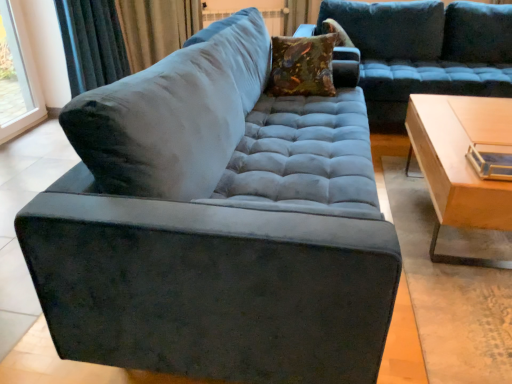
Image resolution: width=512 pixels, height=384 pixels. I want to click on velvet floral pillow at center, positioned as the second pillow in back-to-front order, so click(302, 66).

Find the location of `light wood/wooden table at right`. light wood/wooden table at right is located at coordinates (462, 163).

Find the location of a particular element. The width and height of the screenshot is (512, 384). transparent glass window at upper left is located at coordinates (17, 77).

Where is `velvet floral pillow at center, positioned as the second pillow in back-to-front order`? velvet floral pillow at center, positioned as the second pillow in back-to-front order is located at coordinates (302, 66).

Considering the sizes of light wood/wooden table at right and velvet floral pillow at center, which is counted as the first pillow, starting from the bottom, in the image, is light wood/wooden table at right bigger or smaller than velvet floral pillow at center, which is counted as the first pillow, starting from the bottom,?

In the image, light wood/wooden table at right appears to be larger than velvet floral pillow at center, which is counted as the first pillow, starting from the bottom.

From a real-world perspective, is light wood/wooden table at right on top of velvet floral pillow at center, which is counted as the 1th pillow, starting from the left?

Incorrect, from a real-world perspective, light wood/wooden table at right is lower than velvet floral pillow at center, which is counted as the 1th pillow, starting from the left.

Does light wood/wooden table at right turn towards velvet floral pillow at center, which is counted as the first pillow, starting from the bottom?

No, light wood/wooden table at right is not turned towards velvet floral pillow at center, which is counted as the first pillow, starting from the bottom.

Is the position of light wood/wooden table at right more distant than that of velvet floral pillow at center, placed as the 2th pillow when sorted from top to bottom?

No, the depth of light wood/wooden table at right is less than that of velvet floral pillow at center, placed as the 2th pillow when sorted from top to bottom.

Is transparent glass window at upper left oriented away from velvet-like brown pillow at upper center, which appears as the second pillow when viewed from the front?

transparent glass window at upper left does not have its back to velvet-like brown pillow at upper center, which appears as the second pillow when viewed from the front.

Can you confirm if transparent glass window at upper left is shorter than velvet-like brown pillow at upper center, the first pillow in the back-to-front sequence?

In fact, transparent glass window at upper left may be taller than velvet-like brown pillow at upper center, the first pillow in the back-to-front sequence.

Which of these two, transparent glass window at upper left or velvet-like brown pillow at upper center, marked as the second pillow in a bottom-to-top arrangement, is smaller?

transparent glass window at upper left.

Does point (15, 42) appear closer or farther from the camera than point (345, 32)?

Point (15, 42) is farther from the camera than point (345, 32).

Can you confirm if velvet curtain at upper left is shorter than velvet floral pillow at center, which is the first pillow in front-to-back order?

Incorrect, the height of velvet curtain at upper left does not fall short of that of velvet floral pillow at center, which is the first pillow in front-to-back order.

The image size is (512, 384). What are the coordinates of `curtain beneath the velvet floral pillow at center, positioned as the second pillow in back-to-front order (from a real-world perspective)` in the screenshot? It's located at (121, 36).

Considering their positions, is velvet curtain at upper left located in front of or behind velvet floral pillow at center, the second pillow viewed from the right?

In the image, velvet curtain at upper left appears behind velvet floral pillow at center, the second pillow viewed from the right.

Is velvet curtain at upper left turned away from velvet floral pillow at center, which is counted as the first pillow, starting from the bottom?

velvet curtain at upper left is not turned away from velvet floral pillow at center, which is counted as the first pillow, starting from the bottom.

Does velvet floral pillow at center, which is counted as the 1th pillow, starting from the left, have a smaller size compared to velvet blue couch at upper center?

Yes, velvet floral pillow at center, which is counted as the 1th pillow, starting from the left, is smaller than velvet blue couch at upper center.

Is velvet floral pillow at center, the second pillow viewed from the right, not near velvet blue couch at upper center?

Yes, velvet floral pillow at center, the second pillow viewed from the right, and velvet blue couch at upper center are quite far apart.

Choose the correct answer: Is velvet floral pillow at center, which is counted as the first pillow, starting from the bottom, inside velvet blue couch at upper center or outside it?

velvet floral pillow at center, which is counted as the first pillow, starting from the bottom, is not enclosed by velvet blue couch at upper center.

Does velvet curtain at upper left have a lesser width compared to velvet blue couch at upper center?

Yes, velvet curtain at upper left is thinner than velvet blue couch at upper center.

Considering the sizes of objects velvet curtain at upper left and velvet blue couch at upper center in the image provided, who is bigger, velvet curtain at upper left or velvet blue couch at upper center?

With larger size is velvet blue couch at upper center.

Between point (121, 75) and point (372, 101), which one is positioned behind?

The point (121, 75) is farther.

The image size is (512, 384). Find the location of `table located in front of the velvet-like brown pillow at upper center, marked as the second pillow in a bottom-to-top arrangement`. table located in front of the velvet-like brown pillow at upper center, marked as the second pillow in a bottom-to-top arrangement is located at coordinates (462, 163).

Considering the relative positions of light wood/wooden table at right and velvet-like brown pillow at upper center, placed as the 1th pillow when sorted from top to bottom, in the image provided, is light wood/wooden table at right to the left or to the right of velvet-like brown pillow at upper center, placed as the 1th pillow when sorted from top to bottom,?

Clearly, light wood/wooden table at right is on the right of velvet-like brown pillow at upper center, placed as the 1th pillow when sorted from top to bottom, in the image.

Which is behind, point (420, 139) or point (329, 20)?

The point (329, 20) is farther from the camera.

From a real-world perspective, is velvet-like brown pillow at upper center, the first pillow in the back-to-front sequence, above or below velvet blue couch at upper center?

velvet-like brown pillow at upper center, the first pillow in the back-to-front sequence, is above velvet blue couch at upper center.

Would you consider velvet-like brown pillow at upper center, placed as the 1th pillow when sorted from top to bottom, to be distant from velvet blue couch at upper center?

No.

From the image's perspective, between velvet-like brown pillow at upper center, marked as the second pillow in a bottom-to-top arrangement, and velvet blue couch at upper center, which one is located above?

velvet-like brown pillow at upper center, marked as the second pillow in a bottom-to-top arrangement, appears higher in the image.

This screenshot has height=384, width=512. What are the coordinates of `the 1st pillow positioned above the light wood/wooden table at right (from the image's perspective)` in the screenshot? It's located at (302, 66).

Locate an element on the screen. This screenshot has height=384, width=512. pillow behind the transparent glass window at upper left is located at coordinates point(337,32).

Which object lies further to the anchor point transparent glass window at upper left, velvet blue couch at upper center or light wood/wooden table at right?

light wood/wooden table at right is further to transparent glass window at upper left.

Based on their spatial positions, is velvet curtain at upper left or velvet blue couch at upper center closer to light wood/wooden table at right?

Based on the image, velvet blue couch at upper center appears to be nearer to light wood/wooden table at right.

Considering their positions, is velvet blue couch at upper center positioned closer to light wood/wooden table at right than velvet floral pillow at center, which is the first pillow in front-to-back order?

Among the two, velvet floral pillow at center, which is the first pillow in front-to-back order, is located nearer to light wood/wooden table at right.

Based on their spatial positions, is velvet-like brown pillow at upper center, marked as the second pillow in a bottom-to-top arrangement, or light wood/wooden table at right closer to velvet curtain at upper left?

Among the two, velvet-like brown pillow at upper center, marked as the second pillow in a bottom-to-top arrangement, is located nearer to velvet curtain at upper left.

When comparing their distances from velvet-like brown pillow at upper center, acting as the first pillow starting from the right, does light wood/wooden table at right or velvet curtain at upper left seem closer?

Based on the image, light wood/wooden table at right appears to be nearer to velvet-like brown pillow at upper center, acting as the first pillow starting from the right.

Considering their positions, is transparent glass window at upper left positioned further to light wood/wooden table at right than velvet-like brown pillow at upper center, marked as the second pillow in a bottom-to-top arrangement?

transparent glass window at upper left lies further to light wood/wooden table at right than the other object.

Estimate the real-world distances between objects in this image. Which object is further from velvet floral pillow at center, positioned as the second pillow in back-to-front order, transparent glass window at upper left or light wood/wooden table at right?

The object further to velvet floral pillow at center, positioned as the second pillow in back-to-front order, is transparent glass window at upper left.

Considering their positions, is velvet floral pillow at center, positioned as the second pillow in back-to-front order, positioned closer to velvet curtain at upper left than velvet-like brown pillow at upper center, acting as the first pillow starting from the right?

velvet floral pillow at center, positioned as the second pillow in back-to-front order, is closer to velvet curtain at upper left.

The height and width of the screenshot is (384, 512). What are the coordinates of `pillow located between transparent glass window at upper left and velvet-like brown pillow at upper center, acting as the first pillow starting from the right, in the left-right direction` in the screenshot? It's located at (302, 66).

I want to click on curtain situated between transparent glass window at upper left and velvet blue couch at upper center from left to right, so click(121, 36).

Find the location of a particular element. curtain between transparent glass window at upper left and velvet-like brown pillow at upper center, the first pillow in the back-to-front sequence, in the horizontal direction is located at coordinates (121, 36).

Locate an element on the screen. The image size is (512, 384). table situated between velvet curtain at upper left and velvet blue couch at upper center from left to right is located at coordinates (462, 163).